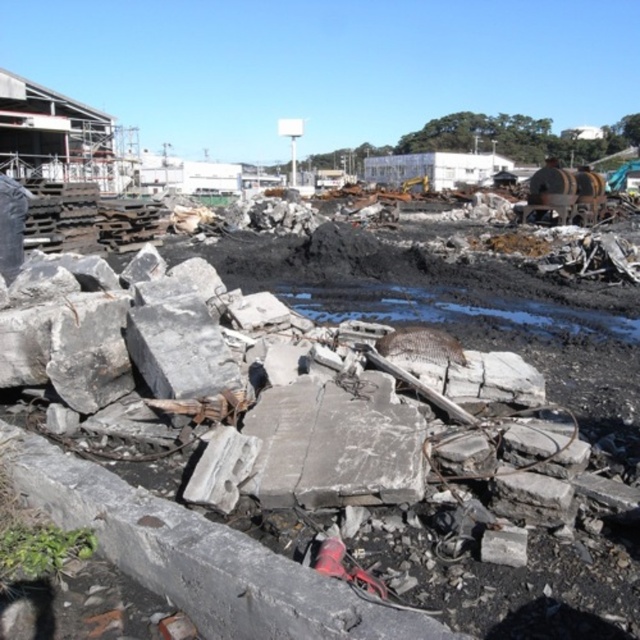
You are a construction worker standing at the edge of the trench in the midground. You notice two points marked in the scene. Which point, point (380, 627) or point (173, 342), is closer to you?

Point (380, 627) is closer to the viewer than point (173, 342).

You are a construction worker standing at the point marked by the coordinate point [204,557]. What material are you currently standing on?

The point [204,557] indicates gray concrete rubble at center, so you are standing on gray concrete rubble.